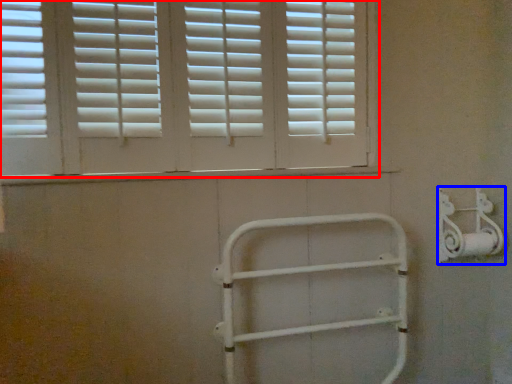
Question: Which of the following is the closest to the observer, window (highlighted by a red box) or metal (highlighted by a blue box)?

Choices:
 (A) window
 (B) metal

Answer: (A)